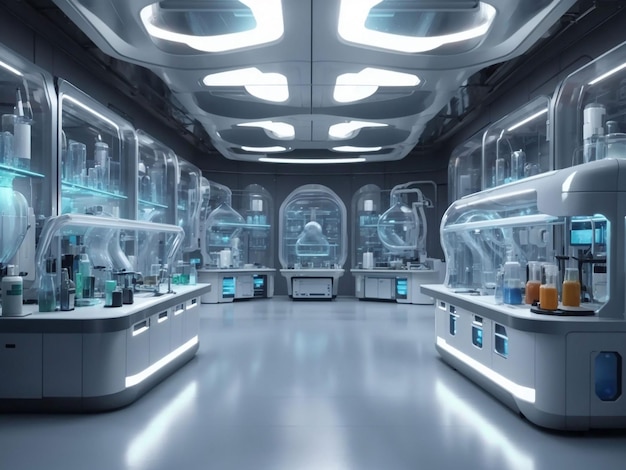
Locate an element on the screen. The width and height of the screenshot is (626, 470). floor is located at coordinates (346, 386).